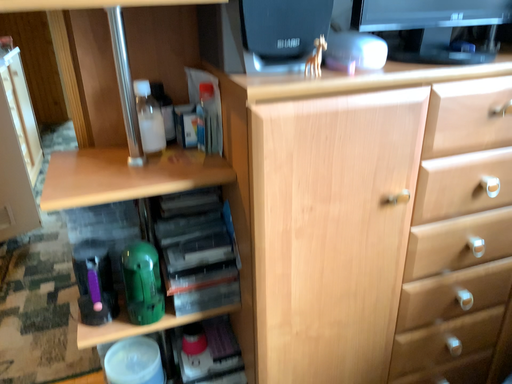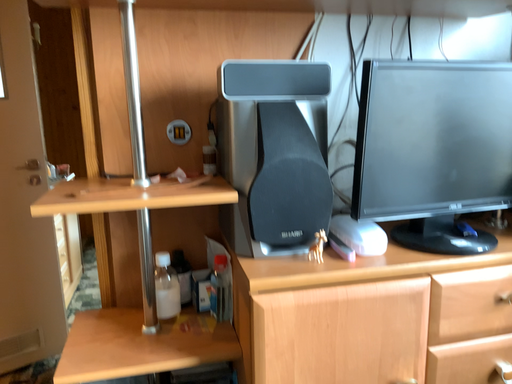
Question: How did the camera likely rotate when shooting the video?

Choices:
 (A) rotated upward
 (B) rotated downward

Answer: (A)